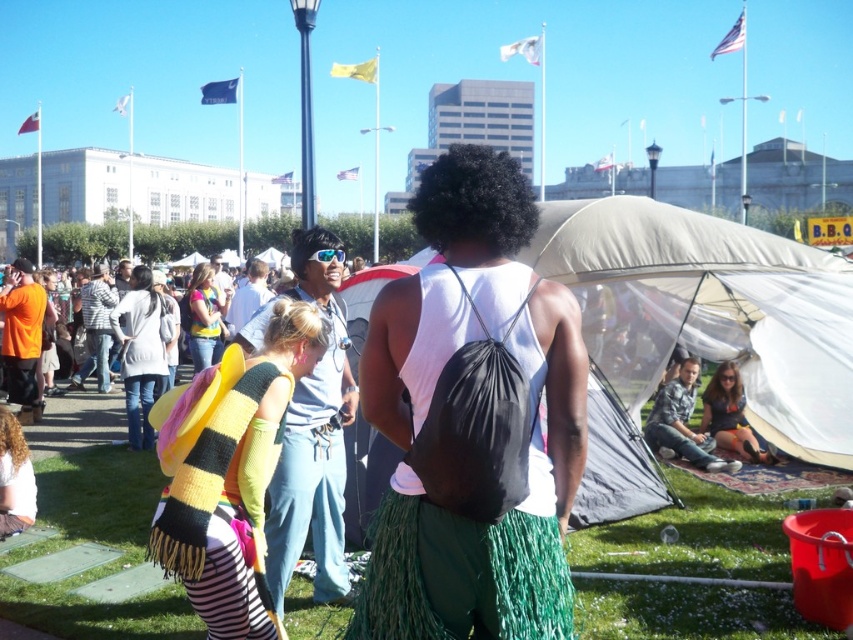
You are standing in the festival crowd and see the knitted scarf at center and the matte black sunglasses at upper center. Which item is located to the left of the other?

The knitted scarf at center is positioned on the left side of matte black sunglasses at upper center.

You are a photographer trying to capture a clear shot of both the black matte backpack at center and the black matte afro at center. Based on their positions, which object should you adjust your camera angle to focus on first to ensure both are in frame?

The black matte backpack at center is positioned on the right side of the black matte afro at center. To ensure both are in frame, you should first focus on the black matte afro at center, then adjust your angle to include the backpack on its right side.

You are a photographer trying to capture a clear shot of both the black matte backpack at center and the black matte afro at center. Since you want to ensure both are fully visible in your frame, which object should you focus on first to avoid cropping any part of them?

The black matte backpack at center is taller than the black matte afro at center, so you should focus on framing the black matte backpack at center first to ensure its full height is captured, then adjust to include the black matte afro at center.